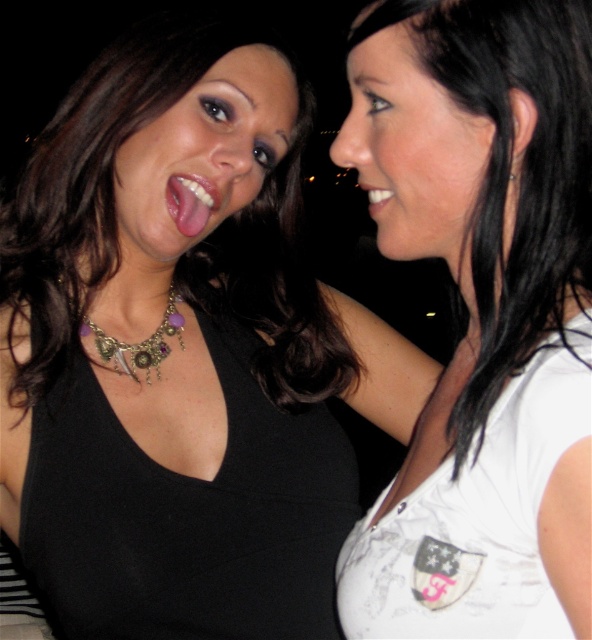
Question: Is pink glossy tongue at center to the left of silver metallic earring at upper right from the viewer's perspective?

Choices:
 (A) no
 (B) yes

Answer: (B)

Question: Is white glossy teeth at center positioned at the back of silver metallic earring at upper right?

Choices:
 (A) yes
 (B) no

Answer: (A)

Question: Among these objects, which one is farthest from the camera?

Choices:
 (A) gold-toned metallic necklace at center
 (B) silver metallic earring at upper right
 (C) matte black face at center
 (D) white matte shirt at right

Answer: (A)

Question: Based on their relative distances, which object is farther from the white glossy teeth at center?

Choices:
 (A) matte black face at center
 (B) matte white face at upper right
 (C) gold-toned metallic necklace at center
 (D) white matte shirt at right

Answer: (C)

Question: Is the position of gold-toned metallic necklace at center less distant than that of pink glossy tongue at center?

Choices:
 (A) no
 (B) yes

Answer: (A)

Question: Which object is positioned farthest from the matte white face at upper right?

Choices:
 (A) pink glossy tongue at center
 (B) silver metallic earring at upper right

Answer: (A)